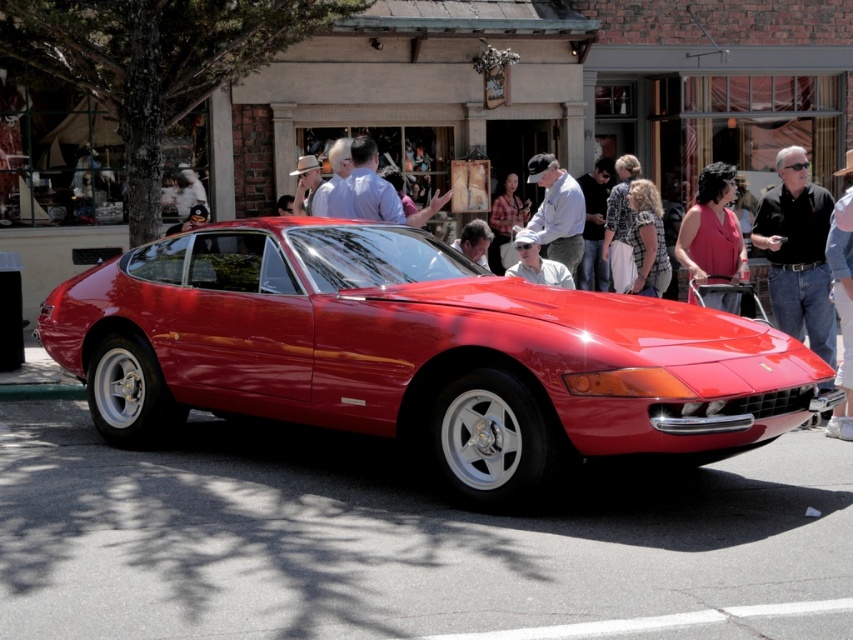
Question: Can you confirm if black shirt at center is smaller than denim jacket at lower right?

Choices:
 (A) no
 (B) yes

Answer: (A)

Question: Which object appears closest to the camera in this image?

Choices:
 (A) denim jacket at lower right
 (B) matte gray shirt at center

Answer: (A)

Question: Is matte gray shirt at center bigger than matte white shirt at center?

Choices:
 (A) no
 (B) yes

Answer: (B)

Question: Does shiny red car at center have a lesser width compared to matte gray shirt at center?

Choices:
 (A) no
 (B) yes

Answer: (A)

Question: Which of the following is the closest to the observer?

Choices:
 (A) (850, 323)
 (B) (523, 260)
 (C) (318, 208)

Answer: (A)

Question: Among these points, which one is nearest to the camera?

Choices:
 (A) click(314, 164)
 (B) click(840, 422)
 (C) click(566, 180)

Answer: (B)